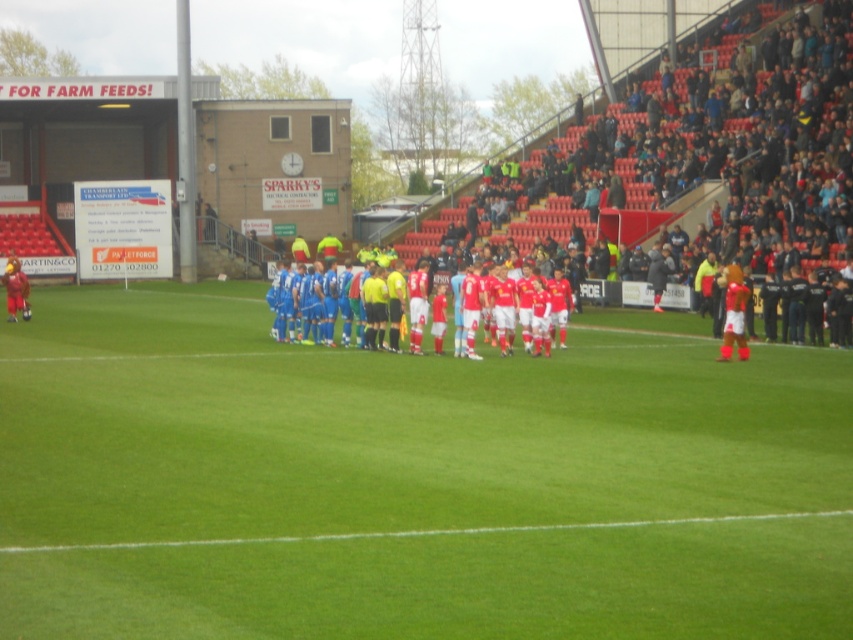
You are a photographer at the soccer match. You need to capture a wide shot that includes both the green grass field at center and the blue fabric jersey at center. Which object should you focus on first to ensure both are in frame?

The green grass field at center is bigger than the blue fabric jersey at center, so focusing on the larger field first will help ensure both objects are included in the frame.

You are a soccer player standing at the edge of the green grass field at center. You want to throw a ball to the blue fabric jersey at center. Can you reach it without leaving the field?

The green grass field at center is 6.24 meters away from the blue fabric jersey at center. Since you are on the field, you can throw the ball to the blue fabric jersey at center as long as you can throw 6.24 meters.

You are a photographer at the soccer match. You need to capture a wide shot of the blue fabric jersey at center and the green grass field at center. Which object will appear wider in the photo?

The green grass field at center will appear wider in the photo because its width surpasses that of the blue fabric jersey at center.